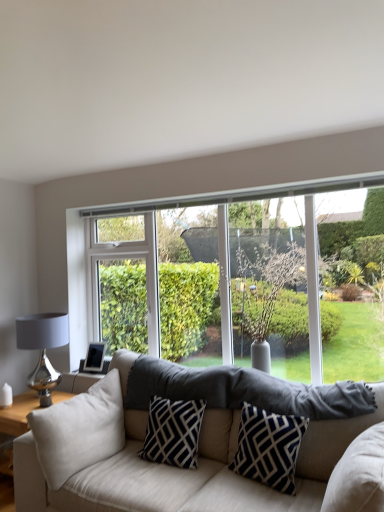
Question: Could you tell me if clear glass window at center is facing beige fabric couch at center?

Choices:
 (A) no
 (B) yes

Answer: (A)

Question: Considering the relative sizes of clear glass window at center and beige fabric couch at center in the image provided, is clear glass window at center thinner than beige fabric couch at center?

Choices:
 (A) yes
 (B) no

Answer: (A)

Question: Does clear glass window at center appear on the right side of beige fabric couch at center?

Choices:
 (A) yes
 (B) no

Answer: (A)

Question: Is clear glass window at center located outside beige fabric couch at center?

Choices:
 (A) no
 (B) yes

Answer: (B)

Question: Would you say beige fabric couch at center is part of clear glass window at center's contents?

Choices:
 (A) no
 (B) yes

Answer: (A)

Question: Does clear glass window at center come in front of beige fabric couch at center?

Choices:
 (A) no
 (B) yes

Answer: (A)

Question: Is navy blue/white geometric pillow at center, arranged as the 1th pillow when viewed from the right, far away from shiny metallic table lamp at left?

Choices:
 (A) yes
 (B) no

Answer: (A)

Question: Does navy blue/white geometric pillow at center, which appears as the 3th pillow when viewed from the left, have a greater width compared to shiny metallic table lamp at left?

Choices:
 (A) no
 (B) yes

Answer: (A)

Question: Is navy blue/white geometric pillow at center, which appears as the 3th pillow when viewed from the left, turned away from shiny metallic table lamp at left?

Choices:
 (A) yes
 (B) no

Answer: (B)

Question: Is navy blue/white geometric pillow at center, which appears as the 3th pillow when viewed from the left, at the left side of shiny metallic table lamp at left?

Choices:
 (A) yes
 (B) no

Answer: (B)

Question: Does navy blue/white geometric pillow at center, arranged as the 1th pillow when viewed from the right, have a lesser height compared to shiny metallic table lamp at left?

Choices:
 (A) yes
 (B) no

Answer: (A)

Question: From the image's perspective, is navy blue/white geometric pillow at center, which appears as the 3th pillow when viewed from the left, located beneath shiny metallic table lamp at left?

Choices:
 (A) yes
 (B) no

Answer: (A)

Question: From the image's perspective, is shiny metallic table lamp at left under navy blue/white geometric pillow at center, arranged as the 1th pillow when viewed from the right?

Choices:
 (A) yes
 (B) no

Answer: (B)